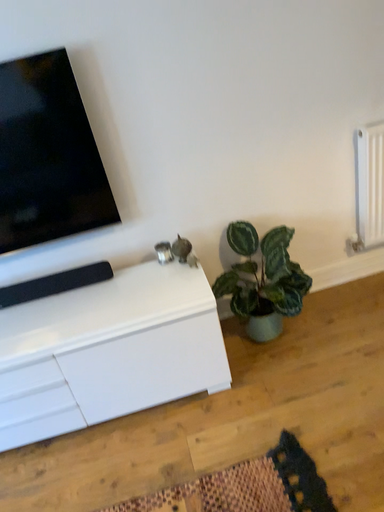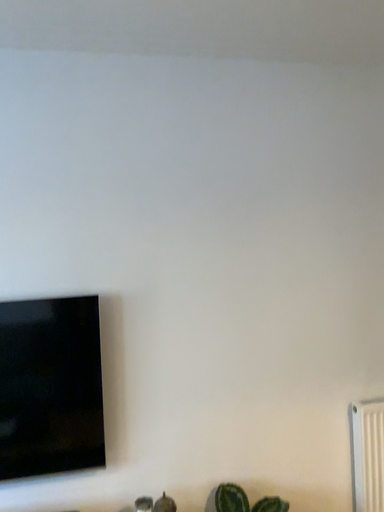
Question: How did the camera likely rotate when shooting the video?

Choices:
 (A) rotated downward
 (B) rotated upward

Answer: (B)